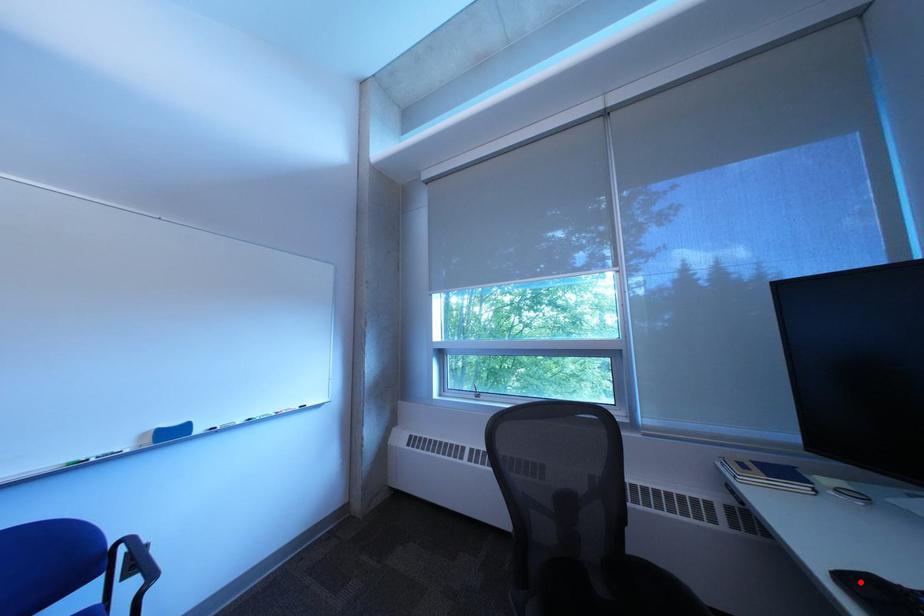
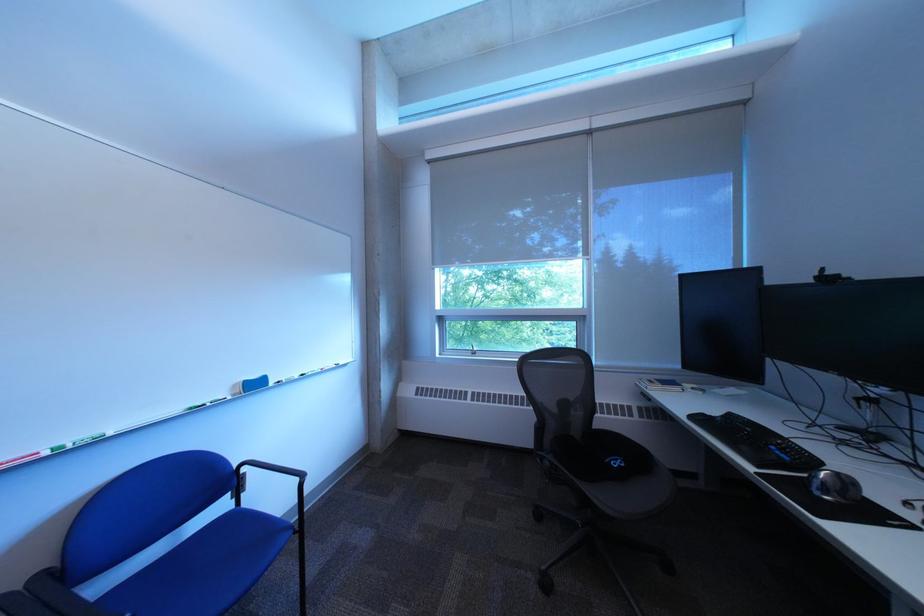
In the second image, find the point that corresponds to the highlighted location in the first image.

(708, 419)